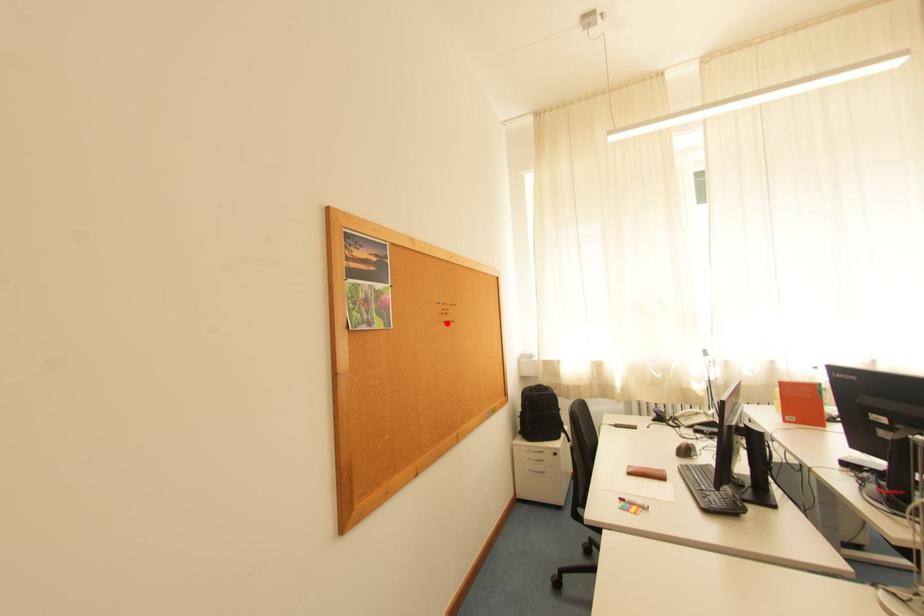
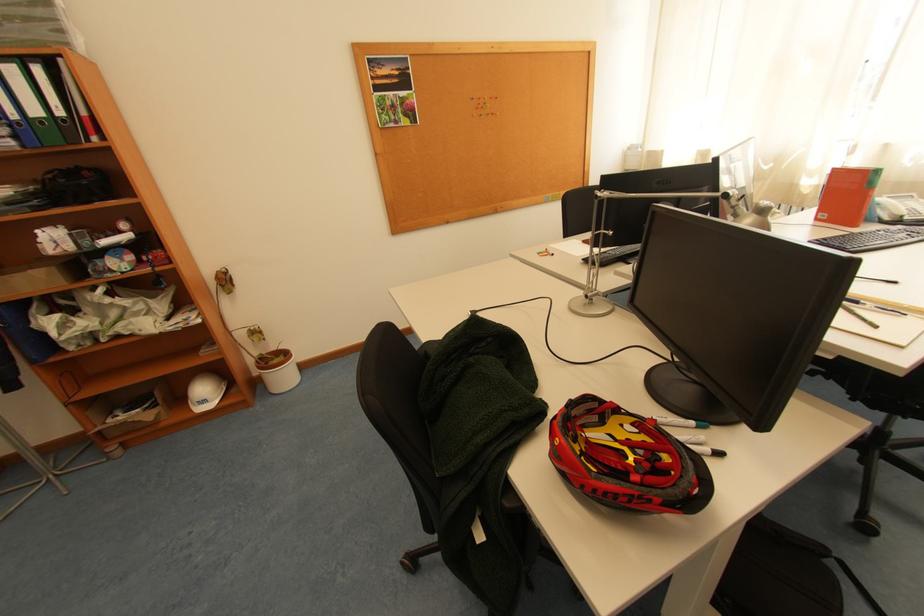
In the second image, find the point that corresponds to the highlighted location in the first image.

(481, 118)